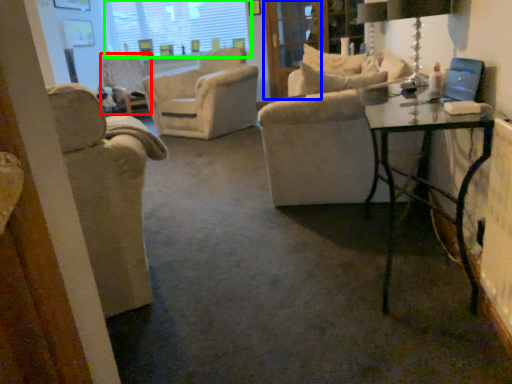
Question: Based on their relative distances, which object is farther from chair (highlighted by a red box)? Choose from screen door (highlighted by a blue box) and window screen (highlighted by a green box).

Choices:
 (A) screen door
 (B) window screen

Answer: (A)